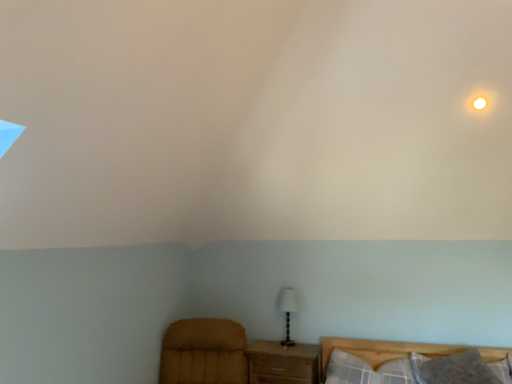
Locate an element on the screen. Image resolution: width=512 pixels, height=384 pixels. vacant space underneath white fabric lampshade at center (from a real-world perspective) is located at coordinates (288, 347).